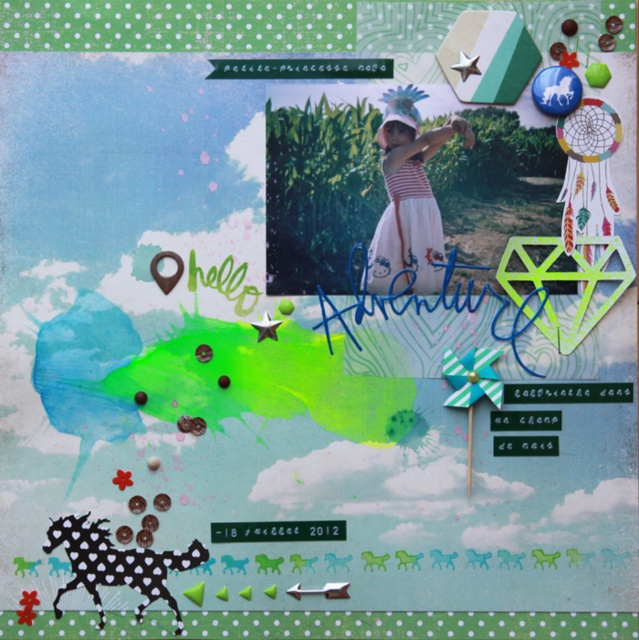
Is striped cotton dress at center closer to camera compared to black dotted horse at lower left?

No.

Does striped cotton dress at center appear under black dotted horse at lower left?

No.

Is point (412, 164) in front of point (158, 556)?

No, (412, 164) is further to viewer.

At what (x,y) coordinates should I click in order to perform the action: click on striped cotton dress at center. Please return your answer as a coordinate pair (x, y). Image resolution: width=639 pixels, height=640 pixels. Looking at the image, I should click on click(x=408, y=195).